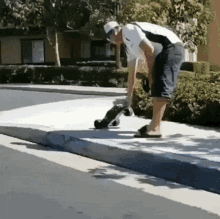
Locate an element on the screen. The width and height of the screenshot is (220, 219). slipper is located at coordinates (141, 133).